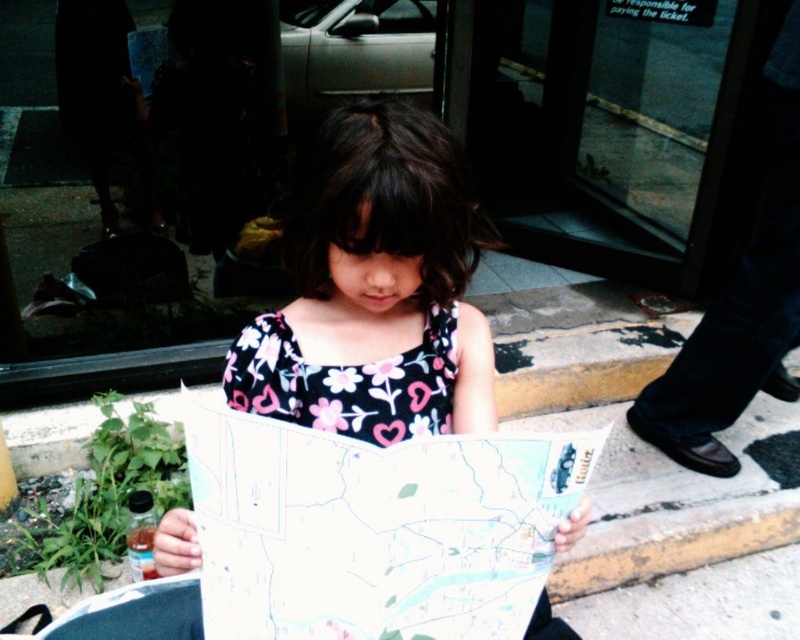
Question: Does white paper map at center have a smaller size compared to floral-patterned fabric dress at center?

Choices:
 (A) no
 (B) yes

Answer: (A)

Question: Among these points, which one is nearest to the camera?

Choices:
 (A) (468, 269)
 (B) (405, 376)

Answer: (A)

Question: Is white paper map at center smaller than floral-patterned fabric dress at center?

Choices:
 (A) yes
 (B) no

Answer: (B)

Question: Can you confirm if white paper map at center is smaller than floral-patterned fabric dress at center?

Choices:
 (A) no
 (B) yes

Answer: (A)

Question: Which of the following is the farthest from the observer?

Choices:
 (A) (330, 250)
 (B) (412, 355)

Answer: (B)